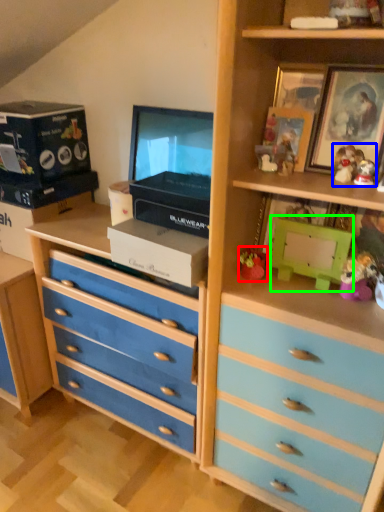
Question: Considering the real-world distances, which object is closest to toy (highlighted by a red box)? toy (highlighted by a blue box) or box (highlighted by a green box).

Choices:
 (A) toy
 (B) box

Answer: (B)